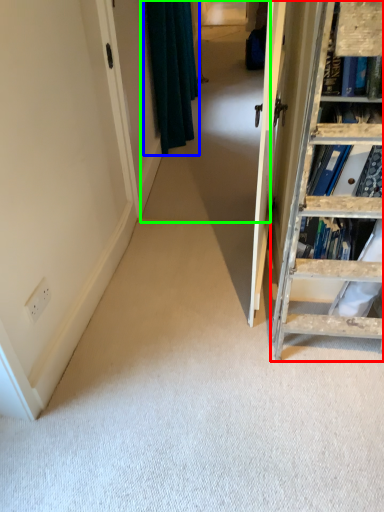
Question: Which object is positioned farthest from ladder (highlighted by a red box)? Select from curtain (highlighted by a blue box) and passage (highlighted by a green box).

Choices:
 (A) curtain
 (B) passage

Answer: (A)